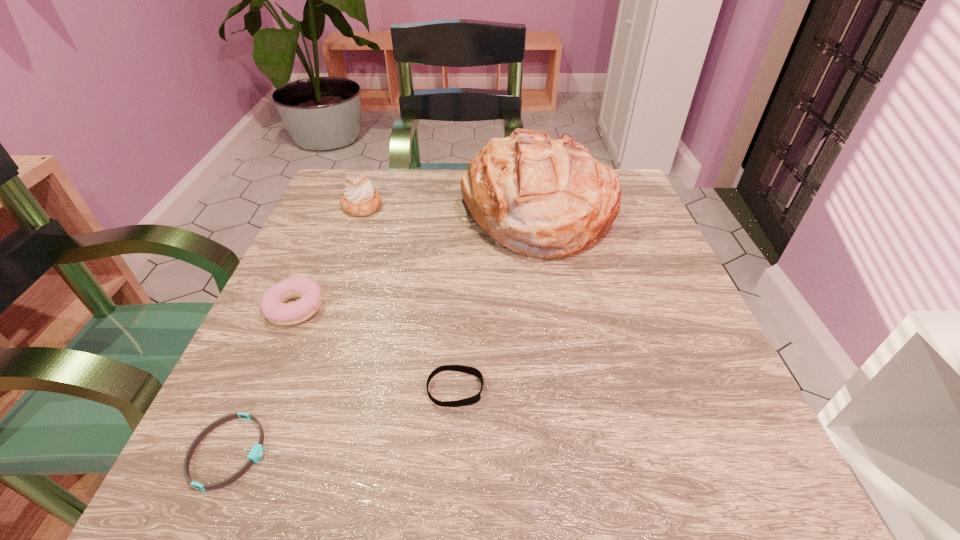
In order to click on free point between the second nearest object and the bread in this screenshot , I will do `click(496, 301)`.

This screenshot has height=540, width=960. I want to click on free space between the doughnut and the bread, so click(416, 261).

The image size is (960, 540). I want to click on free space between the shortest object and the second tallest object, so click(x=296, y=329).

Where is `free space between the bread and the pastry`? free space between the bread and the pastry is located at coordinates (449, 211).

Find the location of a particular element. free area in between the shorter wristband and the tallest object is located at coordinates (383, 333).

You are a GUI agent. You are given a task and a screenshot of the screen. Output one action in this format:
    pyautogui.click(x=<x>, y=<y>)
    Task: Click on the empty space that is in between the second tallest object and the taller wristband
    Image resolution: width=960 pixels, height=540 pixels.
    Given the screenshot: What is the action you would take?
    pyautogui.click(x=409, y=298)

This screenshot has height=540, width=960. In order to click on vacant space that is in between the doughnut and the tallest object in this screenshot , I will do `click(416, 261)`.

Image resolution: width=960 pixels, height=540 pixels. In order to click on free space between the doughnut and the fourth shortest object in this screenshot , I will do `click(328, 258)`.

At what (x,y) coordinates should I click in order to perform the action: click on blank region between the shorter wristband and the bread. Please return your answer as a coordinate pair (x, y). Looking at the image, I should click on point(383,333).

Locate which object ranks third in proximity to the second shortest object. Please provide its 2D coordinates. Your answer should be formatted as a tuple, i.e. [(x, y)], where the tuple contains the x and y coordinates of a point satisfying the conditions above.

[(540, 197)]